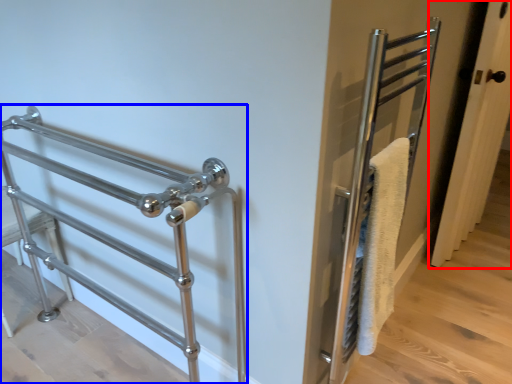
Question: Which object is further to the camera taking this photo, door (highlighted by a red box) or steel (highlighted by a blue box)?

Choices:
 (A) door
 (B) steel

Answer: (A)